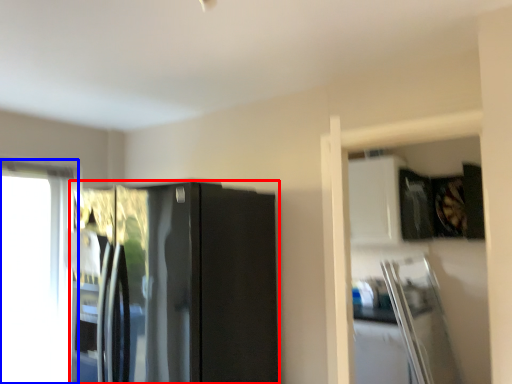
Question: Among these objects, which one is farthest to the camera, refrigerator (highlighted by a red box) or window (highlighted by a blue box)?

Choices:
 (A) refrigerator
 (B) window

Answer: (B)